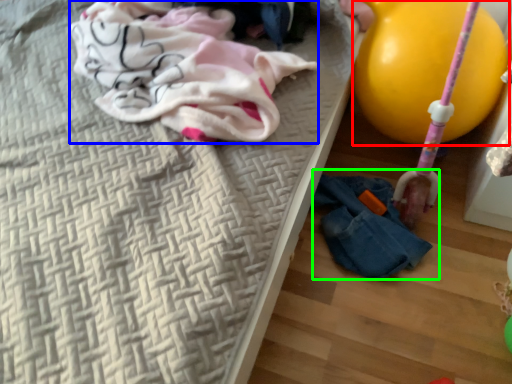
Question: Considering the real-world distances, which object is closest to balloon (highlighted by a red box)? clothing (highlighted by a blue box) or woman (highlighted by a green box).

Choices:
 (A) clothing
 (B) woman

Answer: (B)